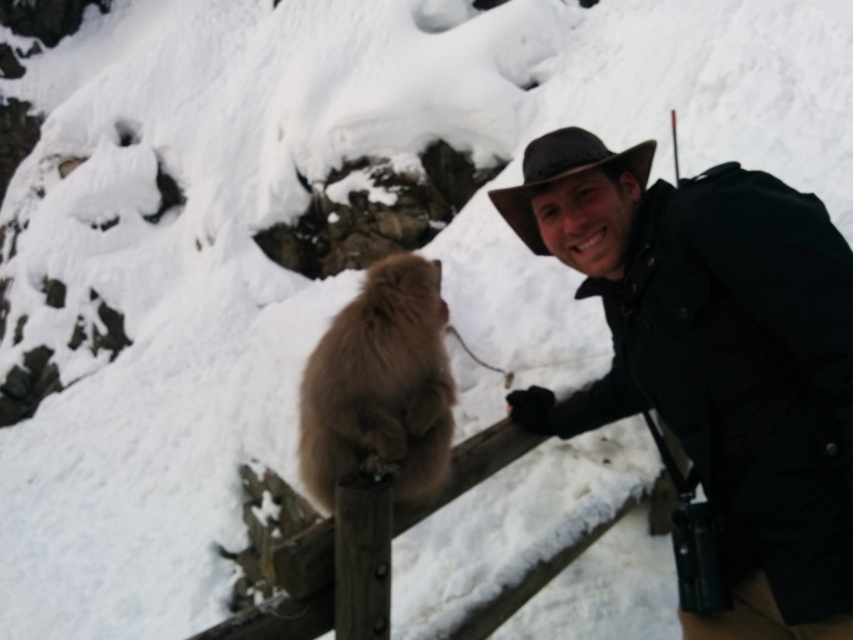
Which of these two, wooden fence at center or fuzzy brown monkey at center, stands taller?

fuzzy brown monkey at center is taller.

Identify the location of wooden fence at center. pos(520,538).

Does point (318, 582) come closer to viewer compared to point (357, 451)?

Yes, point (318, 582) is in front of point (357, 451).

Find the location of a particular element. wooden fence at center is located at coordinates (520, 538).

Between wooden fence at center and brown felt hat at upper right, which one is positioned higher?

Positioned higher is brown felt hat at upper right.

Which of these two, wooden fence at center or brown felt hat at upper right, stands shorter?

wooden fence at center is shorter.

Is point (521, 593) farther from camera compared to point (650, 154)?

Yes.

You are a GUI agent. You are given a task and a screenshot of the screen. Output one action in this format:
    pyautogui.click(x=<x>, y=<y>)
    Task: Click on the wooden fence at center
    The image size is (853, 640).
    Given the screenshot: What is the action you would take?
    pyautogui.click(x=520, y=538)

Who is taller, fuzzy brown monkey at center or brown felt hat at upper right?

Standing taller between the two is fuzzy brown monkey at center.

Is the position of fuzzy brown monkey at center less distant than that of brown felt hat at upper right?

That is True.

This screenshot has width=853, height=640. I want to click on fuzzy brown monkey at center, so click(x=380, y=385).

What are the coordinates of `fuzzy brown monkey at center` in the screenshot? It's located at (380, 385).